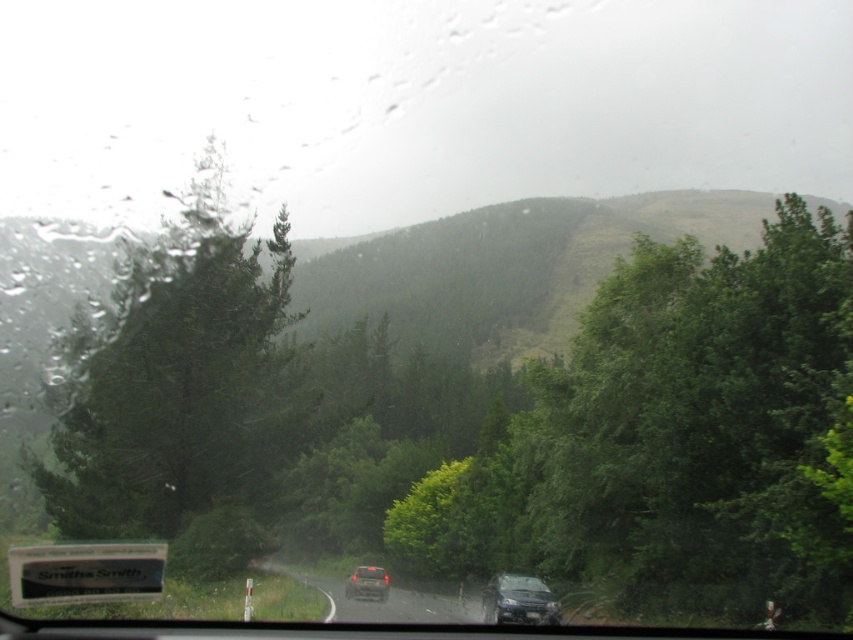
Question: Among these objects, which one is farthest from the camera?

Choices:
 (A) metallic silver suv at lower center
 (B) green textured tree at left
 (C) dark gray asphalt road at center

Answer: (B)

Question: Does dark gray asphalt road at center have a lesser width compared to shiny black car at center?

Choices:
 (A) yes
 (B) no

Answer: (B)

Question: Which object is farther from the camera taking this photo?

Choices:
 (A) green textured tree at left
 (B) dark gray asphalt road at center
 (C) metallic silver suv at lower center
 (D) shiny black car at center

Answer: (D)

Question: Is metallic silver suv at lower center thinner than shiny black car at center?

Choices:
 (A) yes
 (B) no

Answer: (A)

Question: Which object is the closest to the dark gray asphalt road at center?

Choices:
 (A) metallic silver suv at lower center
 (B) green textured tree at left
 (C) shiny black car at center

Answer: (C)

Question: Is metallic silver suv at lower center bigger than shiny black car at center?

Choices:
 (A) yes
 (B) no

Answer: (B)